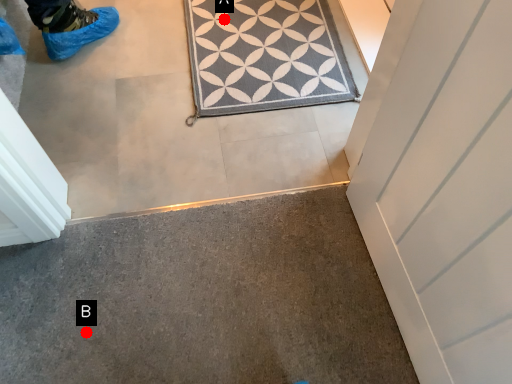
Question: Two points are circled on the image, labeled by A and B beside each circle. Which of the following is the farthest from the observer?

Choices:
 (A) A is further
 (B) B is further

Answer: (A)